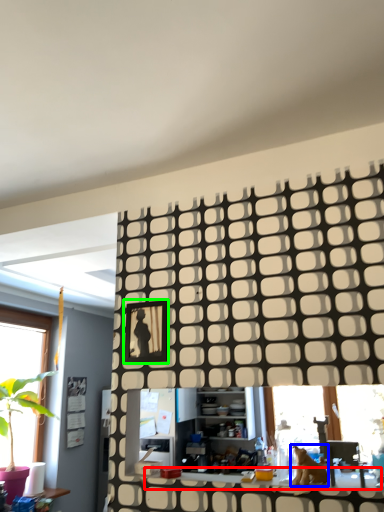
Question: Considering the real-world distances, which object is closest to counter top (highlighted by a red box)? animal (highlighted by a blue box) or picture frame (highlighted by a green box).

Choices:
 (A) animal
 (B) picture frame

Answer: (A)